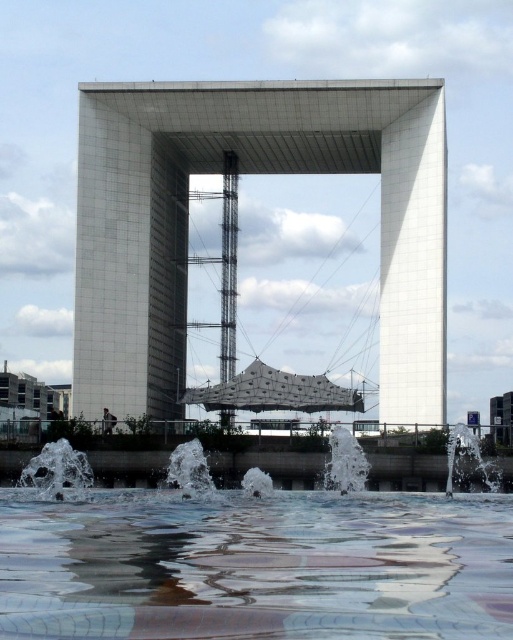
You are an architect designing a new plaza and want to ensure that the white concrete structure at center remains visible above the white frothy water at center. Based on the image, will the structure be visible above the water?

The white concrete structure at center has a greater height compared to white frothy water at center, so yes, the structure will remain visible above the water.

You are an architect designing a new plaza and need to place a bench between the white concrete structure at center and the white smooth pillar at right. Which object should the bench be closer to if you want it to be equidistant from both?

The bench should be placed closer to the white smooth pillar at right since the white concrete structure at center might be wider than the white smooth pillar at right, balancing the distance from both objects.